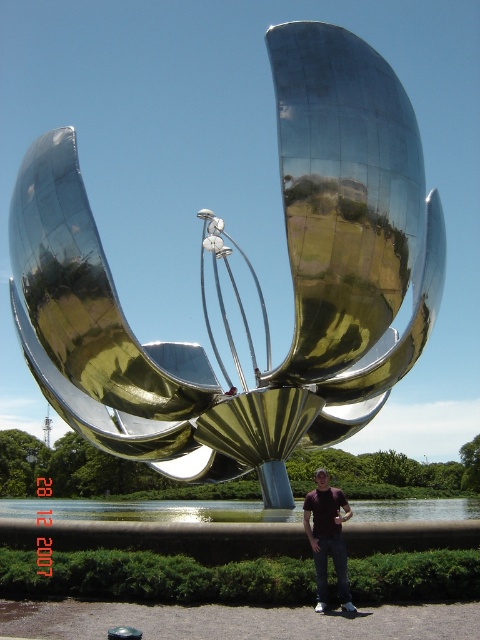
Question: Which point is closer to the camera?

Choices:
 (A) (424, 196)
 (B) (332, 545)

Answer: (B)

Question: Which of the following is the closest to the observer?

Choices:
 (A) dark red t-shirt at center
 (B) polished metallic flower at center

Answer: (A)

Question: Is polished metallic flower at center above dark red t-shirt at center?

Choices:
 (A) yes
 (B) no

Answer: (A)

Question: Is polished metallic flower at center positioned in front of dark red t-shirt at center?

Choices:
 (A) yes
 (B) no

Answer: (B)

Question: Does polished metallic flower at center appear over dark red t-shirt at center?

Choices:
 (A) yes
 (B) no

Answer: (A)